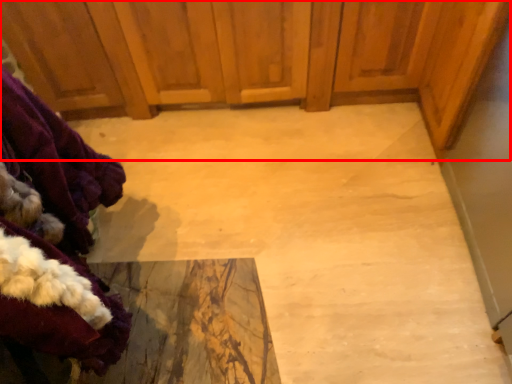
Question: Observing the image, what is the correct spatial positioning of dresser (annotated by the red box) in reference to clothing?

Choices:
 (A) left
 (B) right

Answer: (B)